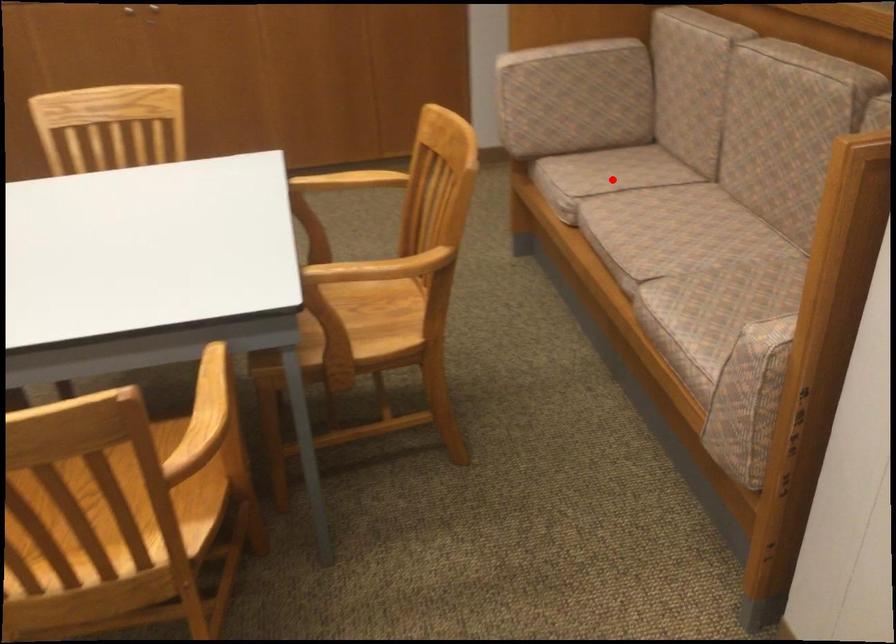
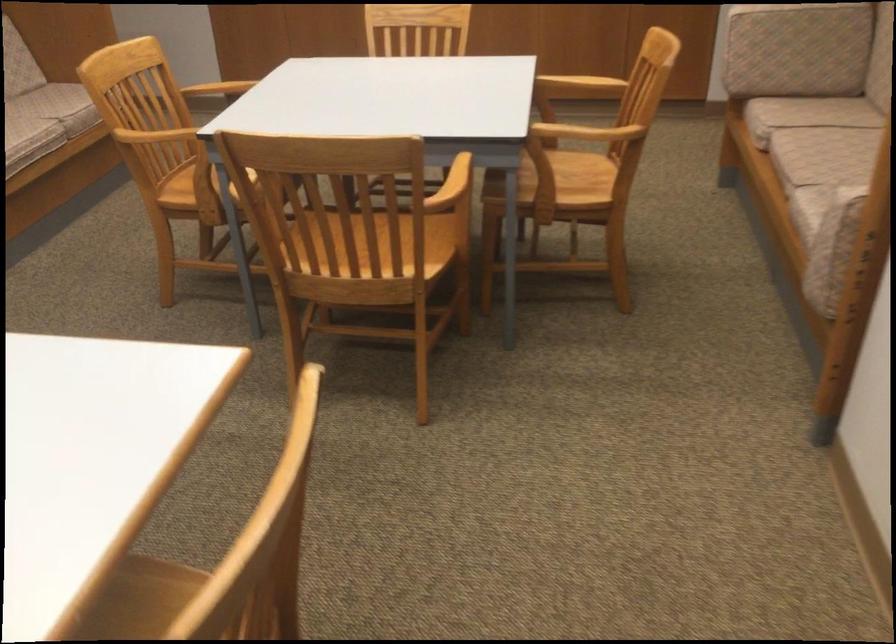
Locate, in the second image, the point that corresponds to the highlighted location in the first image.

(807, 114)